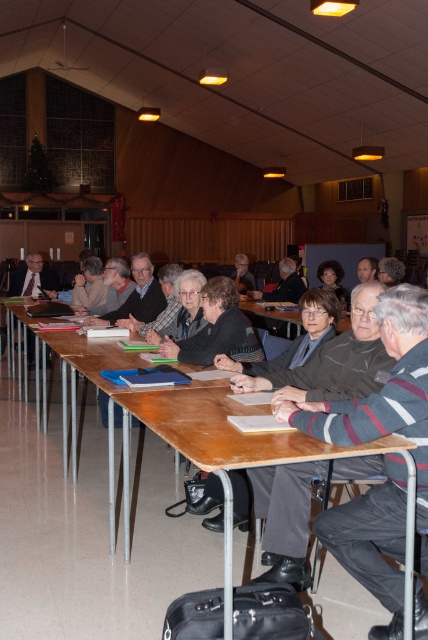
Consider the image. Is striped sweater at center below dark gray sweater at center?

Indeed, striped sweater at center is positioned under dark gray sweater at center.

Does striped sweater at center have a larger size compared to dark gray sweater at center?

No, striped sweater at center is not bigger than dark gray sweater at center.

Locate an element on the screen. The height and width of the screenshot is (640, 428). striped sweater at center is located at coordinates (383, 397).

Identify the location of wooden table at center. The height and width of the screenshot is (640, 428). (229, 458).

Is point (383, 451) in front of point (41, 278)?

That is True.

Locate an element on the screen. This screenshot has height=640, width=428. wooden table at center is located at coordinates (229, 458).

Is brown wooden table at center below matte black suit at left?

Yes.

Locate an element on the screen. Image resolution: width=428 pixels, height=640 pixels. brown wooden table at center is located at coordinates (109, 408).